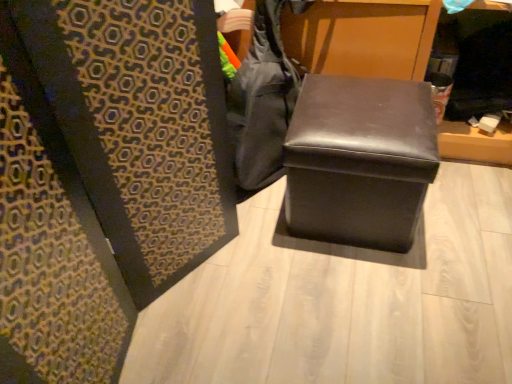
Locate an element on the screen. The height and width of the screenshot is (384, 512). matte black ottoman at center is located at coordinates (360, 160).

Measure the distance between matte black ottoman at center and camera.

The distance of matte black ottoman at center from camera is 1.09 meters.

In order to face matte black ottoman at center, should I rotate leftwards or rightwards?

You should rotate right by 14.082 degrees.

The width and height of the screenshot is (512, 384). What do you see at coordinates (360, 160) in the screenshot? I see `matte black ottoman at center` at bounding box center [360, 160].

You are a GUI agent. You are given a task and a screenshot of the screen. Output one action in this format:
    pyautogui.click(x=<x>, y=<y>)
    Task: Click on the matte black ottoman at center
    Image resolution: width=512 pixels, height=384 pixels.
    Given the screenshot: What is the action you would take?
    pyautogui.click(x=360, y=160)